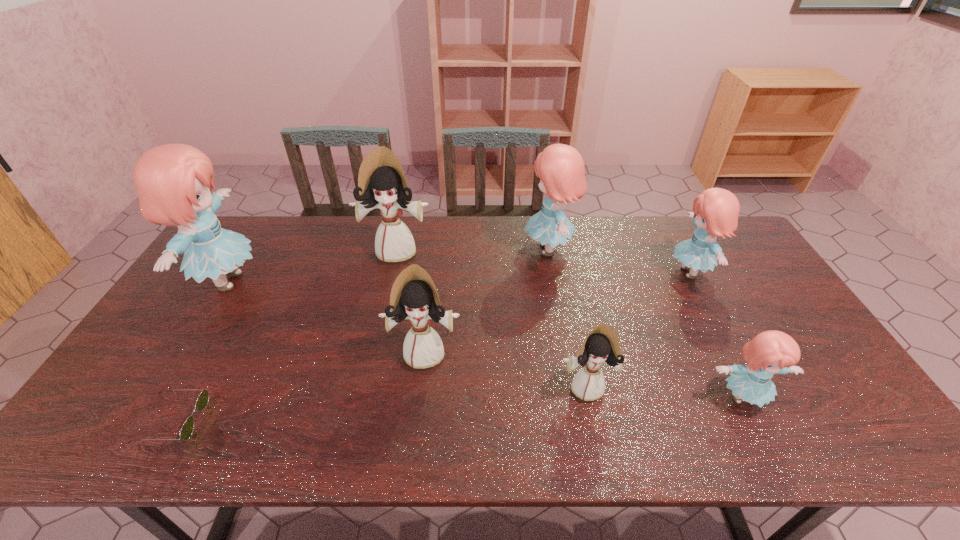
This screenshot has height=540, width=960. What are the coordinates of `vacant space that satisfies the following two spatial constraints: 1. on the front-facing side of the second smallest blue doll; 2. at the front face of the smallest black doll` in the screenshot? It's located at (751, 387).

I want to click on free space that satisfies the following two spatial constraints: 1. at the front face of the farthest black doll; 2. on the front-facing side of the leftmost blue doll, so click(391, 281).

You are a GUI agent. You are given a task and a screenshot of the screen. Output one action in this format:
    pyautogui.click(x=<x>, y=<y>)
    Task: Click on the blank area in the image that satisfies the following two spatial constraints: 1. on the front-facing side of the smallest blue doll; 2. on the front-facing side of the green sunglasses
    The image size is (960, 540).
    Given the screenshot: What is the action you would take?
    pyautogui.click(x=754, y=420)